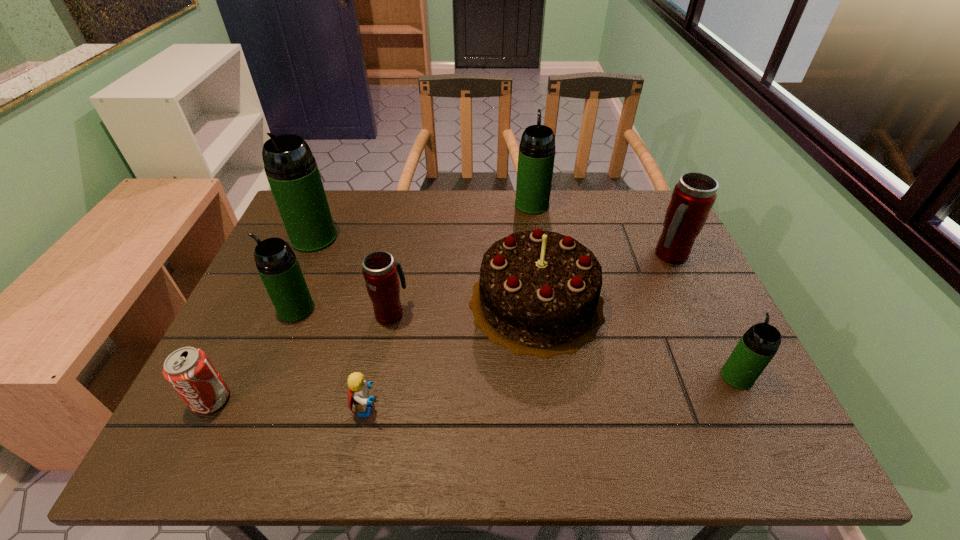
Identify the location of blank space that satisfies the following two spatial constraints: 1. on the side with the handle of the fourth thermos bottle from right to left; 2. from the spout of the second nearest green thermos bottle. (392, 309).

Find the location of `vacant space that satisfies the following two spatial constraints: 1. from the spout of the nearest thermos bottle; 2. from the spout of the second nearest green thermos bottle`. vacant space that satisfies the following two spatial constraints: 1. from the spout of the nearest thermos bottle; 2. from the spout of the second nearest green thermos bottle is located at coordinates (704, 309).